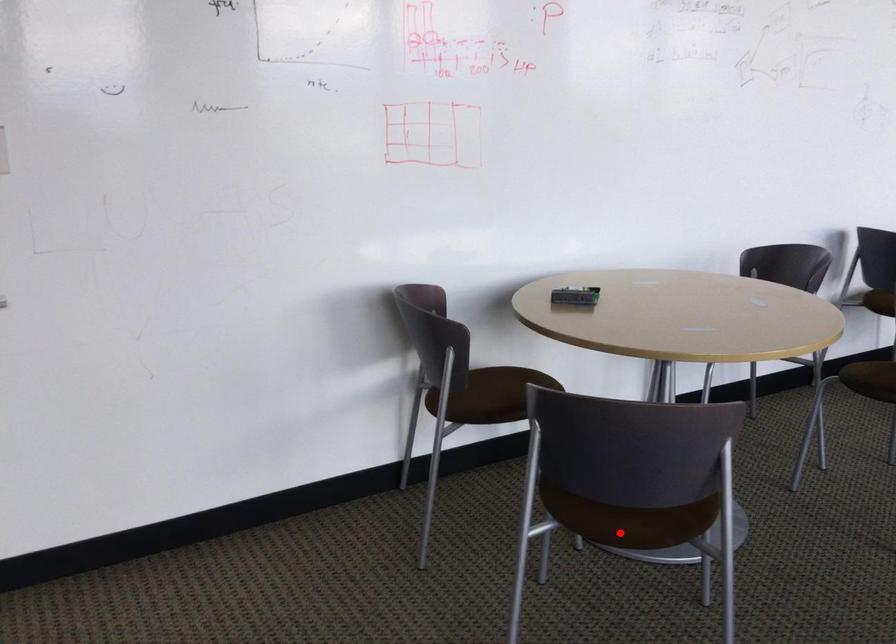
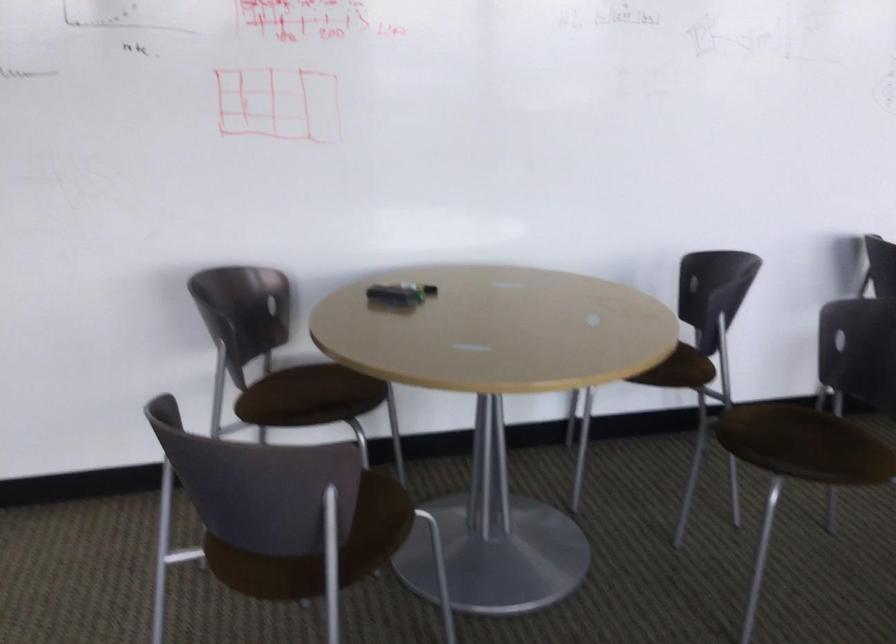
The point at the highlighted location is marked in the first image. Where is the corresponding point in the second image?

(261, 570)